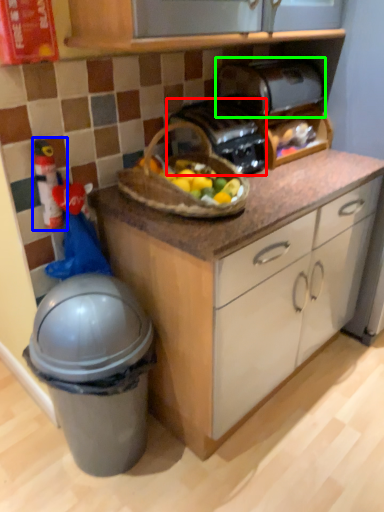
Question: Estimate the real-world distances between objects in this image. Which object is farther from toaster (highlighted by a red box), toy (highlighted by a blue box) or toaster (highlighted by a green box)?

Choices:
 (A) toy
 (B) toaster

Answer: (A)